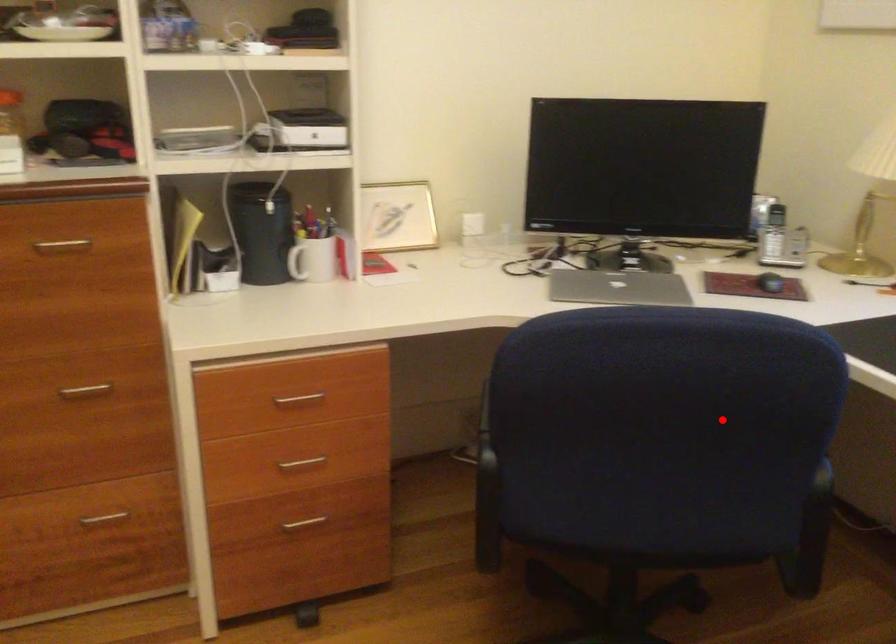
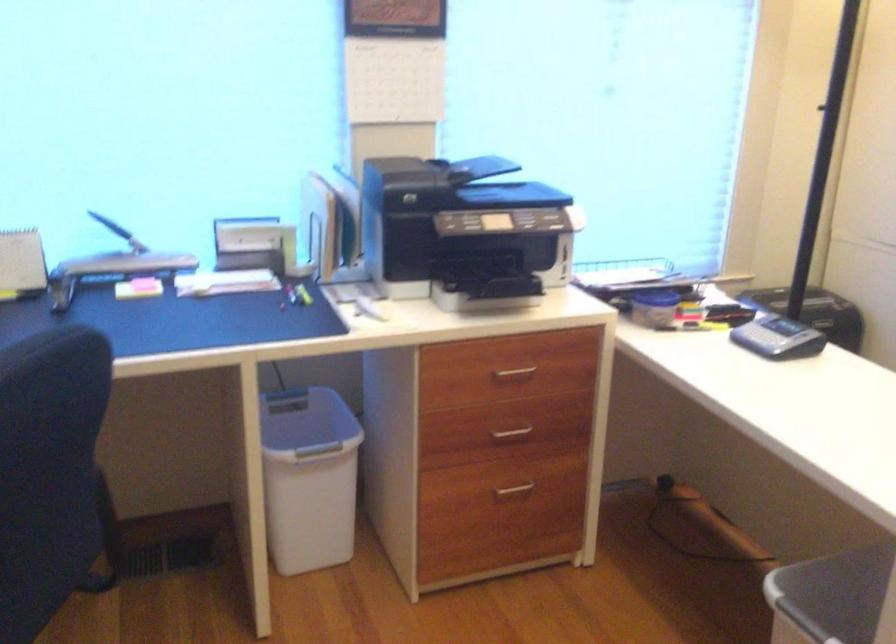
Question: A red point is marked in image1. In image2, is the corresponding 3D point closer to the camera or farther? Reply with the corresponding letter.

Choices:
 (A) The corresponding 3D point is closer.
 (B) The corresponding 3D point is farther.

Answer: (A)